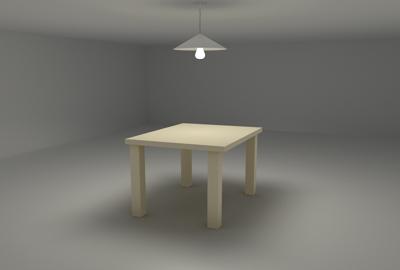
Locate an element on the screen. Image resolution: width=400 pixels, height=270 pixels. lampshade is located at coordinates (206, 45).